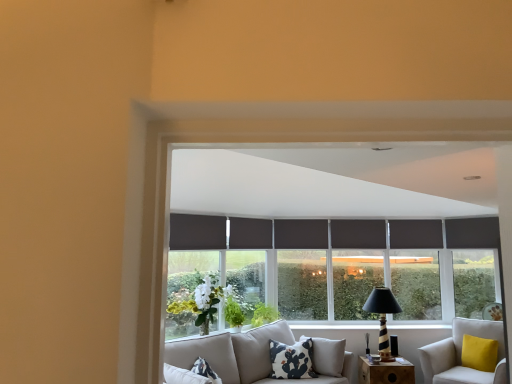
Question: In terms of width, does striped wood table lamp at lower right look wider or thinner when compared to white cotton pillow with black cactus print at center?

Choices:
 (A) wide
 (B) thin

Answer: (A)

Question: In terms of height, does striped wood table lamp at lower right look taller or shorter compared to white cotton pillow with black cactus print at center?

Choices:
 (A) short
 (B) tall

Answer: (B)

Question: Estimate the real-world distances between objects in this image. Which object is closer to the striped wood table lamp at lower right?

Choices:
 (A) white cotton pillow with black cactus print at center
 (B) black fabric curtain at center, the 2th curtain from the back
 (C) white fabric studio couch at lower right
 (D) dark gray fabric curtain at center, the 3th curtain in the front-to-back sequence
 (E) wooden at lower right

Answer: (E)

Question: Based on their relative distances, which object is nearer to the wooden at lower right?

Choices:
 (A) white matte plant at center, the 2th plant from the right
 (B) white fabric studio couch at lower right
 (C) white cotton pillow with black cactus print at center
 (D) striped wood table lamp at lower right
 (E) green leafy plant at center, the 1th plant from the right

Answer: (D)